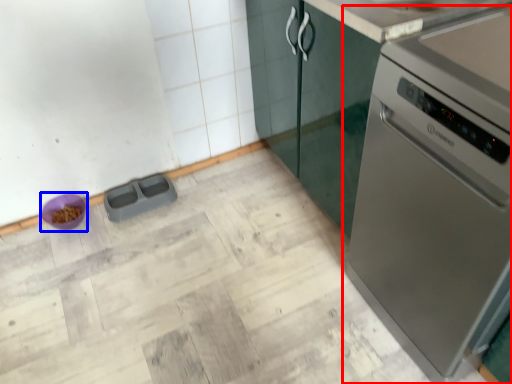
Question: Which object is closer to the camera taking this photo, home appliance (highlighted by a red box) or appliance (highlighted by a blue box)?

Choices:
 (A) home appliance
 (B) appliance

Answer: (A)